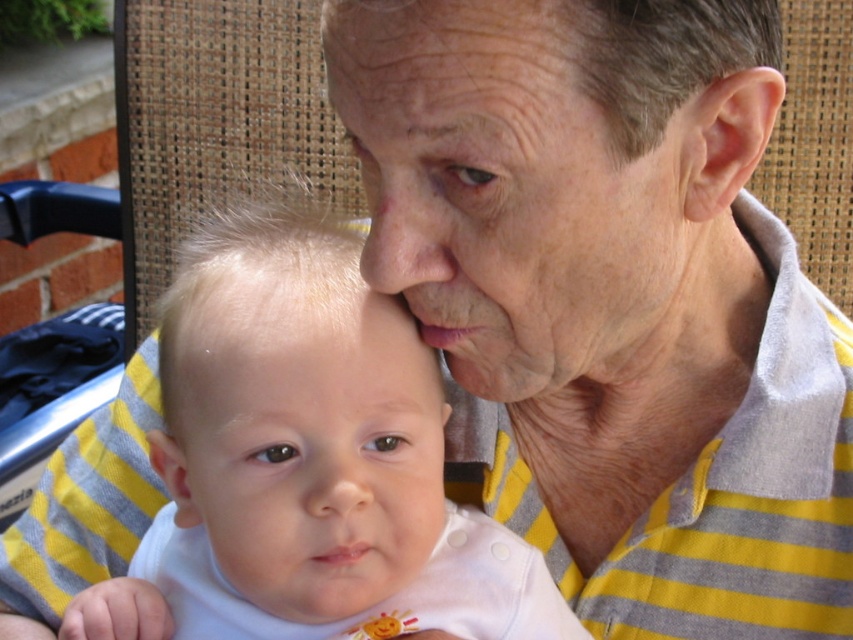
Question: Is dry skin at center positioned in front of smooth white baby at center?

Choices:
 (A) no
 (B) yes

Answer: (B)

Question: Estimate the real-world distances between objects in this image. Which object is farther from the dry skin at center?

Choices:
 (A) white soft fabric baby at center
 (B) smooth white baby at center

Answer: (A)

Question: Observing the image, what is the correct spatial positioning of white soft fabric baby at center in reference to dry skin at center?

Choices:
 (A) left
 (B) right

Answer: (A)

Question: Does white soft fabric baby at center appear under dry skin at center?

Choices:
 (A) no
 (B) yes

Answer: (B)

Question: Estimate the real-world distances between objects in this image. Which object is farther from the dry skin at center?

Choices:
 (A) smooth white baby at center
 (B) white soft fabric baby at center

Answer: (B)

Question: Which point is closer to the camera?

Choices:
 (A) smooth white baby at center
 (B) white soft fabric baby at center

Answer: (B)